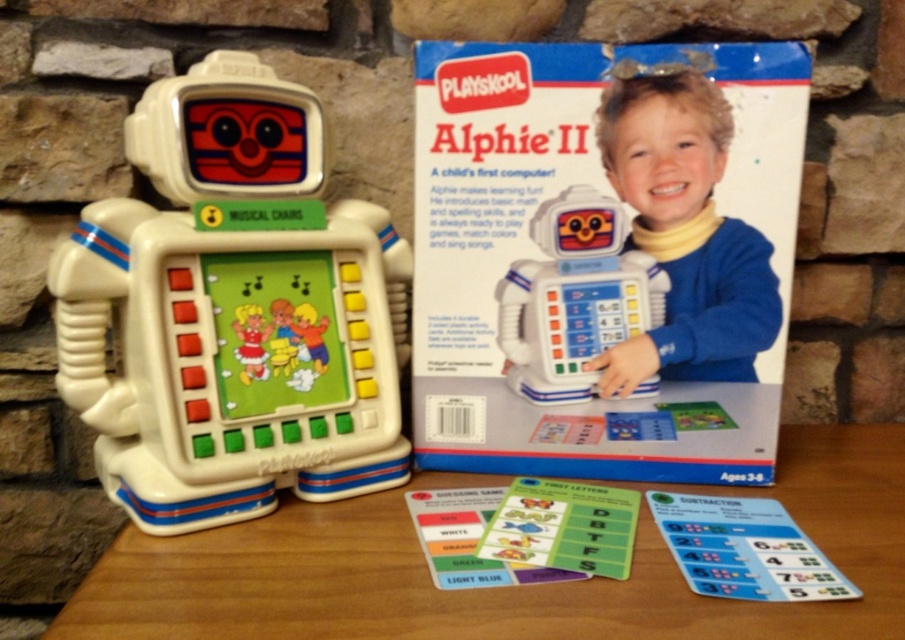
You are a child trying to decide whether to place the white plastic robot at left on top of the yellow turtleneck sweater at upper center. Based on their sizes, will the robot fit entirely on the sweater without hanging over the edges?

The white plastic robot at left is wider than the yellow turtleneck sweater at upper center, so placing it on top would cause the robot to hang over the edges of the sweater.

You are a child who wants to play with the white plastic robot at center. You are currently standing at the wooden table at lower center. Which direction should you move to reach the robot?

The wooden table at lower center is in front of the white plastic robot at center, so you should move backward to reach the robot.

Looking at this image, you are a parent trying to place the white plastic robot at center on the wooden table at lower center. Can the robot fit entirely on the table without overhanging the edges?

The wooden table at lower center is wider than the white plastic robot at center, so yes, the robot can fit entirely on the table without overhanging the edges.